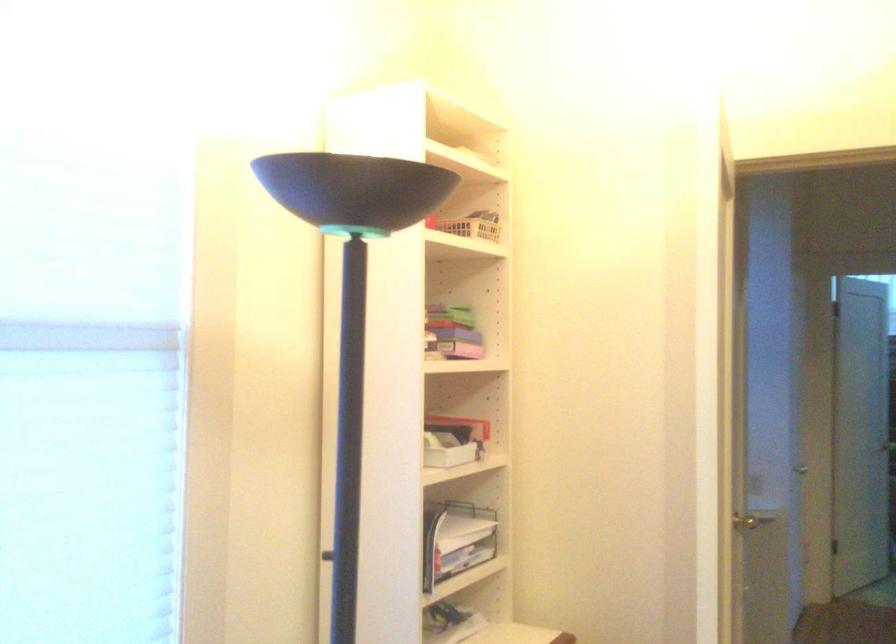
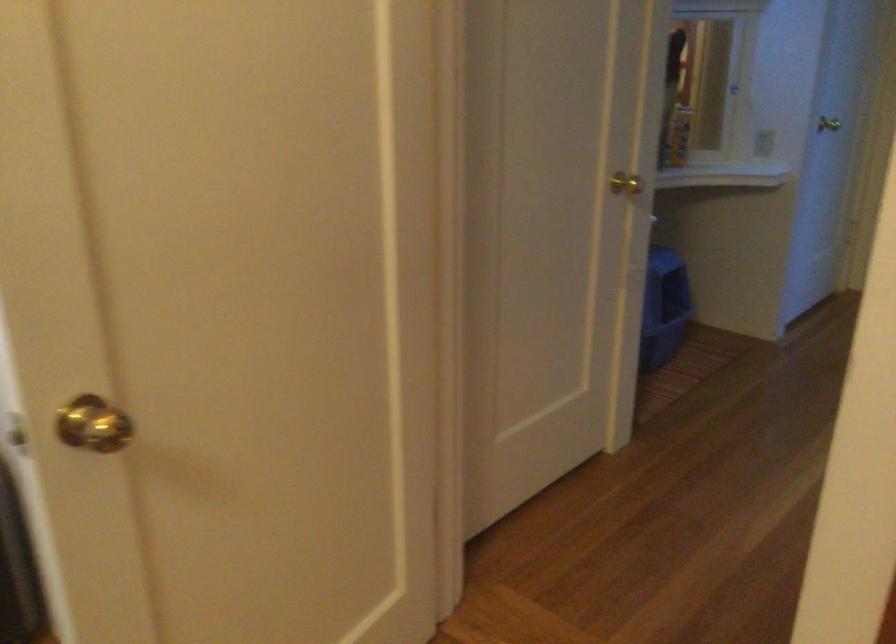
In a continuous first-person perspective shot, in which direction is the camera moving?

The movement direction of the cameraman is right, forward.